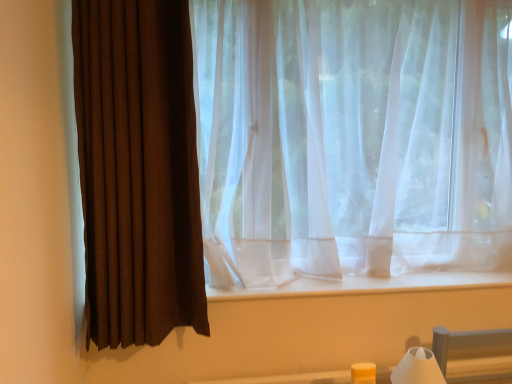
Question: From a real-world perspective, does white matte table lamp at lower right sit lower than brown fabric curtain at left?

Choices:
 (A) no
 (B) yes

Answer: (B)

Question: Considering the relative sizes of white matte table lamp at lower right and brown fabric curtain at left in the image provided, is white matte table lamp at lower right thinner than brown fabric curtain at left?

Choices:
 (A) yes
 (B) no

Answer: (A)

Question: Is white matte table lamp at lower right completely or partially outside of brown fabric curtain at left?

Choices:
 (A) yes
 (B) no

Answer: (A)

Question: Is brown fabric curtain at left at the back of white matte table lamp at lower right?

Choices:
 (A) no
 (B) yes

Answer: (A)

Question: From the image's perspective, would you say white matte table lamp at lower right is positioned over brown fabric curtain at left?

Choices:
 (A) no
 (B) yes

Answer: (A)

Question: Is white matte table lamp at lower right positioned before brown fabric curtain at left?

Choices:
 (A) no
 (B) yes

Answer: (A)

Question: Is brown fabric curtain at left looking in the opposite direction of white matte table lamp at lower right?

Choices:
 (A) no
 (B) yes

Answer: (A)

Question: Is brown fabric curtain at left aimed at white matte table lamp at lower right?

Choices:
 (A) yes
 (B) no

Answer: (B)

Question: From a real-world perspective, is brown fabric curtain at left below white matte table lamp at lower right?

Choices:
 (A) yes
 (B) no

Answer: (B)

Question: From the image's perspective, is brown fabric curtain at left above white matte table lamp at lower right?

Choices:
 (A) no
 (B) yes

Answer: (B)

Question: Can you see brown fabric curtain at left touching white matte table lamp at lower right?

Choices:
 (A) yes
 (B) no

Answer: (B)

Question: Does brown fabric curtain at left lie in front of white matte table lamp at lower right?

Choices:
 (A) no
 (B) yes

Answer: (B)

Question: In the image, is brown fabric curtain at left positioned in front of or behind white matte table lamp at lower right?

Choices:
 (A) behind
 (B) front

Answer: (B)